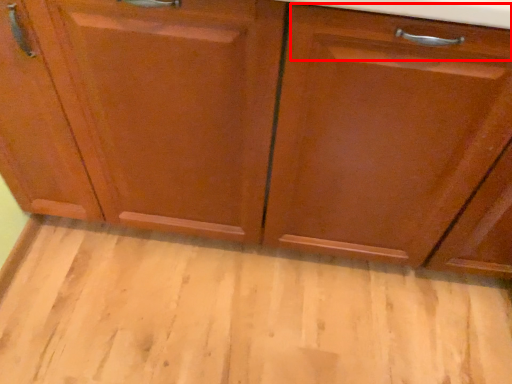
Question: From the image's perspective, where is drawer (annotated by the red box) located in relation to plain in the image?

Choices:
 (A) above
 (B) below

Answer: (A)